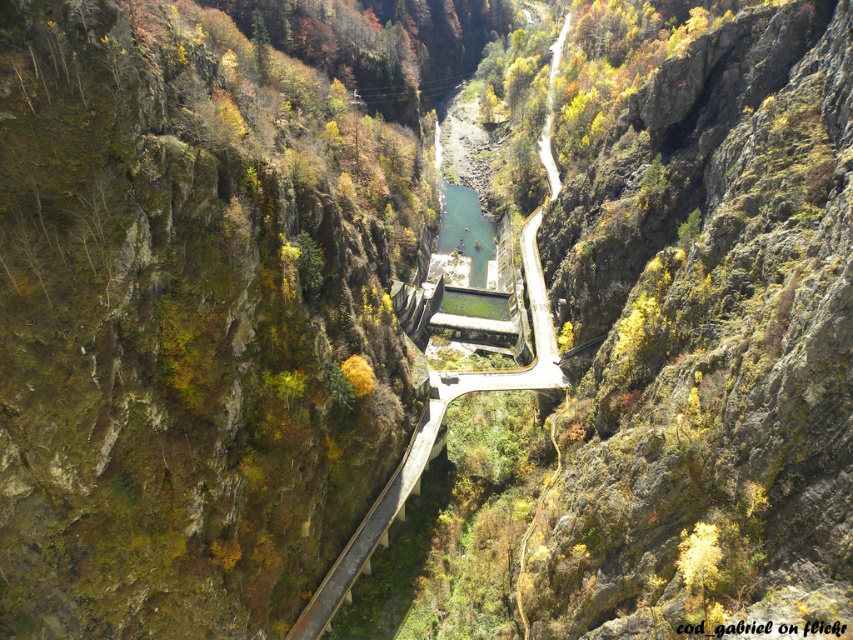
Question: Which point is closer to the camera?

Choices:
 (A) dark gray concrete bridge at center
 (B) concrete at center

Answer: (B)

Question: Among these objects, which one is farthest from the camera?

Choices:
 (A) concrete at center
 (B) green stone river at center

Answer: (B)

Question: In this image, where is concrete at center located relative to dark gray concrete bridge at center?

Choices:
 (A) left
 (B) right

Answer: (A)

Question: Considering the relative positions of concrete at center and green stone river at center in the image provided, where is concrete at center located with respect to green stone river at center?

Choices:
 (A) right
 (B) left

Answer: (A)

Question: Which of the following is the farthest from the observer?

Choices:
 (A) (482, 252)
 (B) (566, 26)
 (C) (445, 300)

Answer: (B)

Question: Does concrete at center lie behind dark gray concrete bridge at center?

Choices:
 (A) no
 (B) yes

Answer: (A)